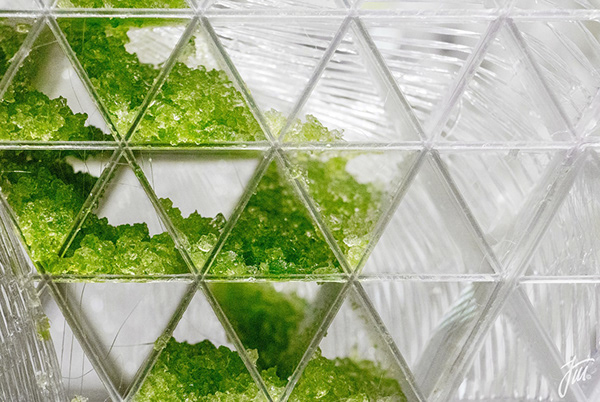
At what (x,y) coordinates should I click in order to perform the action: click on middle horizontal glass panels shown in image. Please return your answer as a coordinate pair (x, y). Looking at the image, I should click on (57, 145), (215, 147), (364, 147), (521, 143), (595, 143).